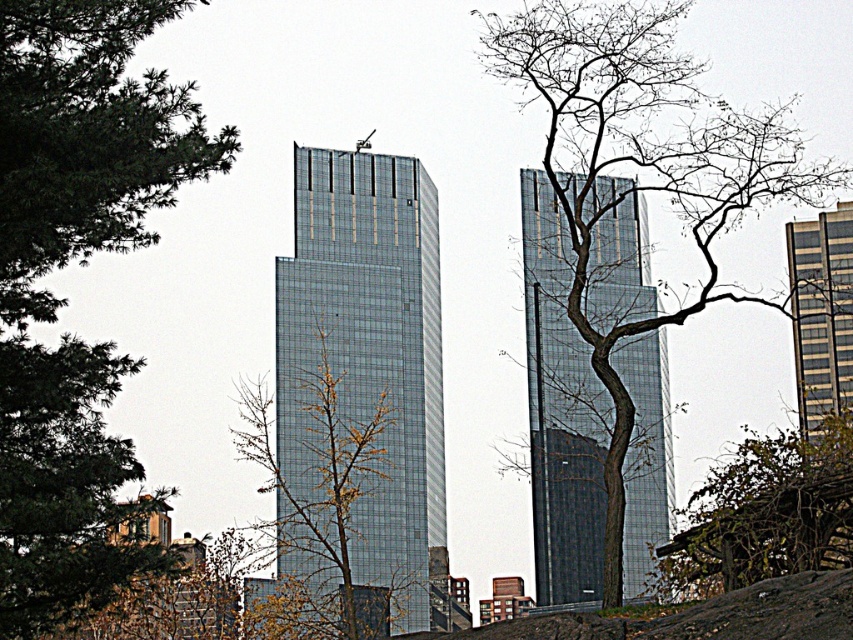
You are a drone operator tasked with flying a drone between two glassy metallic skyscraper at center. The drone has a wingspan of 1.5 meters. Can the drone safely navigate the space between them?

The distance between the two glassy metallic skyscraper at center is 79.61 meters, which is significantly wider than the drone wingspan of 1.5 meters. Yes, the drone can safely navigate the space between them.

You are standing in the urban landscape and want to take a photo of the green leafy tree at left and the gray glass building at right. Which object will appear larger in your photo?

The green leafy tree at left will appear larger in the photo because it is closer to the viewer than the gray glass building at right.